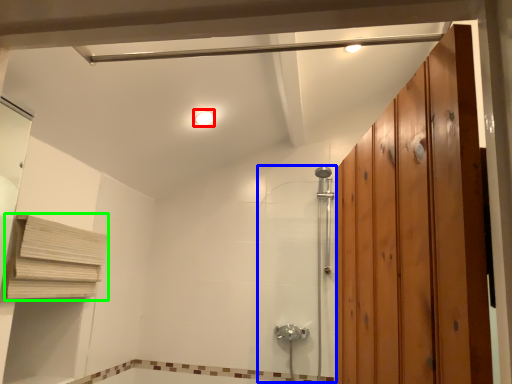
Question: Based on their relative distances, which object is farther from light fixture (highlighted by a red box)? Choose from shower door (highlighted by a blue box) and shelf (highlighted by a green box).

Choices:
 (A) shower door
 (B) shelf

Answer: (A)